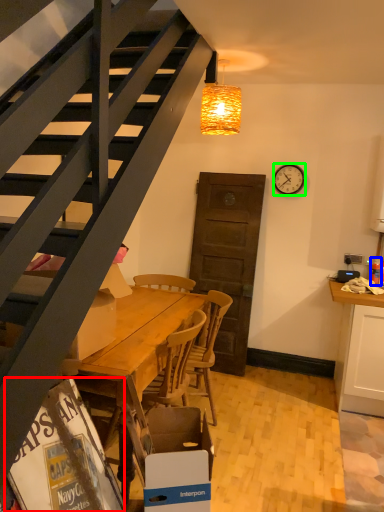
Question: Considering the real-world distances, which object is farthest from magazine (highlighted by a red box)? bottle (highlighted by a blue box) or clock (highlighted by a green box)?

Choices:
 (A) bottle
 (B) clock

Answer: (B)